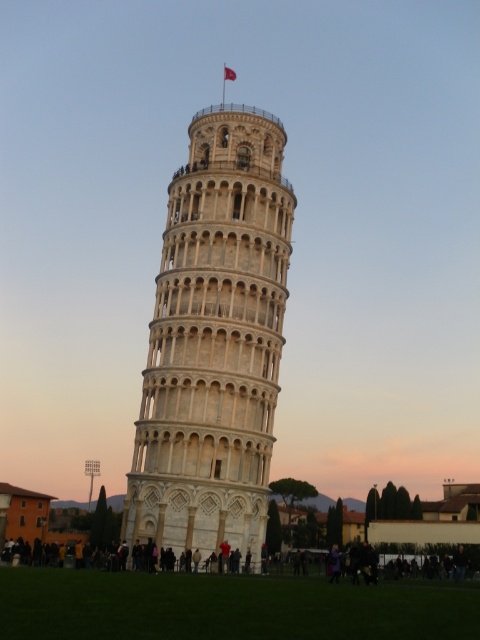
You are a tourist visiting the Leaning Tower of Pisa. You notice the white stone tower at center and the red fabric flag at upper center. Which object is bigger in size?

The white stone tower at center is larger in size compared to the red fabric flag at upper center.

You are standing at the base of the Leaning Tower of Pisa during dusk. You notice two points marked on the tower. One is at coordinate point (202,547) and the other at point (227,72). If you were to walk directly towards the tower from your current position, which point would appear closer to you?

Point (202,547) is in front of point (227,72), so it would appear closer to you when standing at the base of the Leaning Tower of Pisa during dusk.